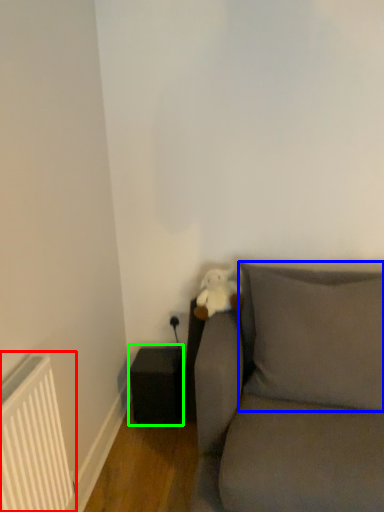
Question: Which is nearer to the radiator (highlighted by a red box)? pillow (highlighted by a blue box) or speaker (highlighted by a green box).

Choices:
 (A) pillow
 (B) speaker

Answer: (B)